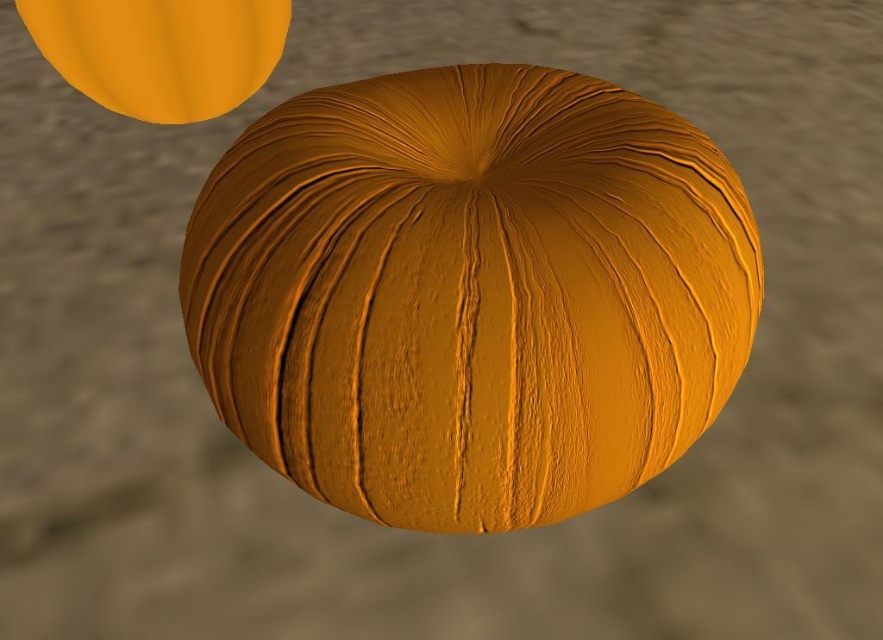
You are an artist trying to paint two matte orange spheres. You have a canvas and want to place them according to their actual sizes. Given that the matte orange sphere at center and the matte orange sphere at upper left are both in the scene, which one should you paint larger to accurately represent their sizes?

The matte orange sphere at center should be painted larger because it might be wider than the matte orange sphere at upper left according to the description.

You are an inspector checking the surface of the matte orange sphere at center. You notice a point at coordinates point (469, 292). Based on the description, where exactly is this point located?

The point (469, 292) is on the matte orange sphere at center.